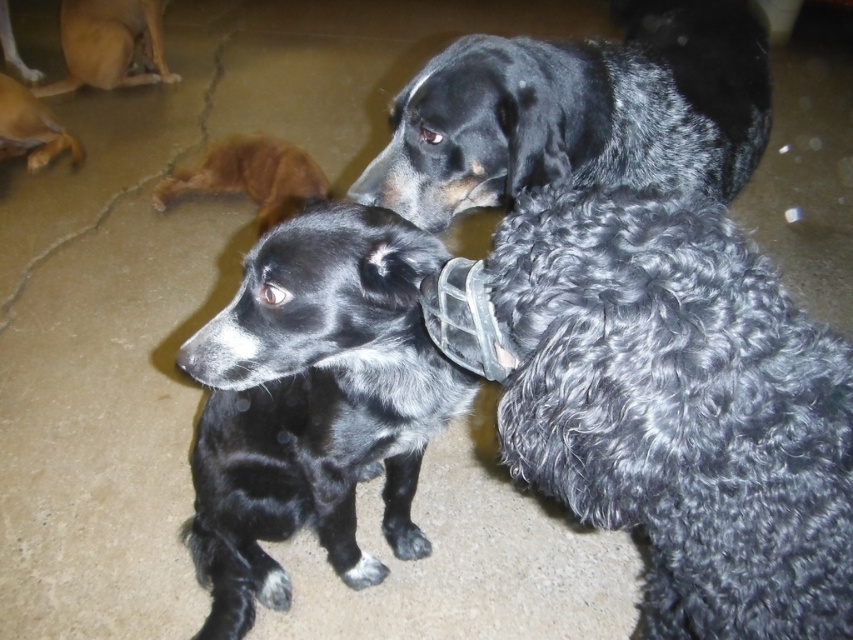
You are a dog trainer assessing the space needed for two dogs. The black fuzzy dog at center and the light brown fur at upper left are both in the room. Which dog requires more horizontal space due to its greater width?

The light brown fur at upper left requires more horizontal space because its width is greater than the black fuzzy dog at center.

You are a dog trainer observing two dogs in the scene. The dogs are curly black fur at center and brown fur at upper left. Which dog do you think is bigger?

The curly black fur at center is larger in size than brown fur at upper left, so the curly black fur at center is bigger.